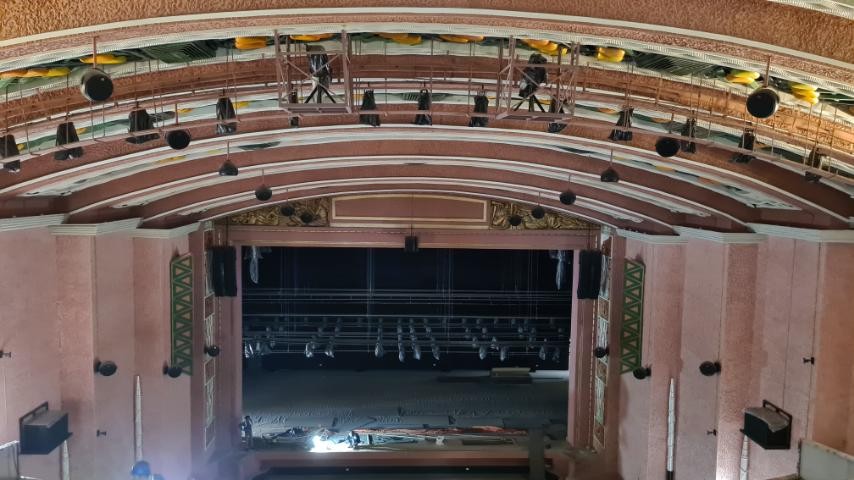
Where is `black speaker mounts`? black speaker mounts is located at coordinates (20, 419), (792, 418).